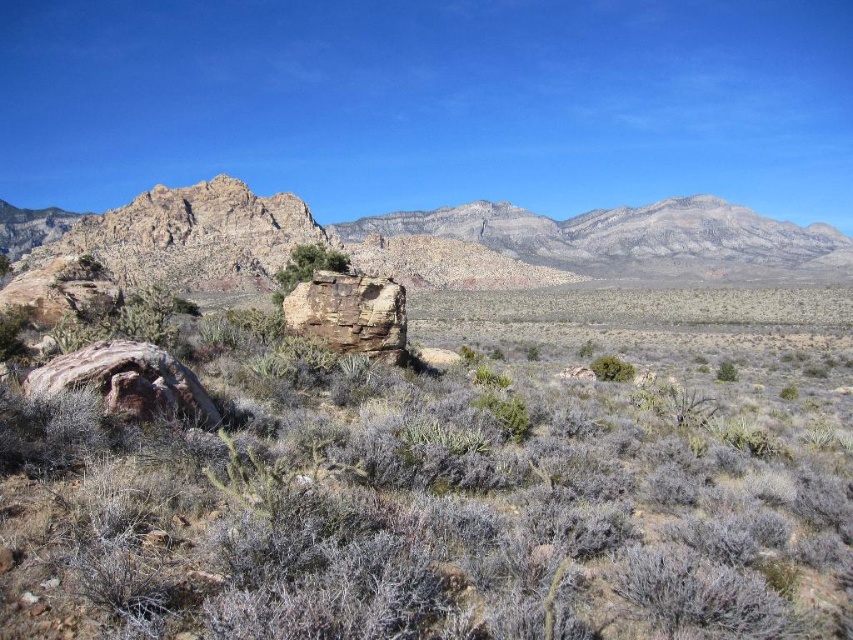
Question: Does rusty rock at center appear under rugged rock formation at upper center?

Choices:
 (A) yes
 (B) no

Answer: (A)

Question: Can you confirm if rusty rock at center is smaller than green leafy bush at center?

Choices:
 (A) no
 (B) yes

Answer: (A)

Question: Which of the following is the closest to the observer?

Choices:
 (A) rusty rock at center
 (B) green leafy shrub at center

Answer: (A)

Question: Does rusty rock at center lie in front of green leafy shrub at center?

Choices:
 (A) yes
 (B) no

Answer: (A)

Question: Which object is the farthest from the green leafy bush at center?

Choices:
 (A) green leafy shrub at center
 (B) rusty rock formation at center
 (C) rugged rock formation at upper center

Answer: (C)

Question: Among these points, which one is nearest to the camera?

Choices:
 (A) (381, 563)
 (B) (315, 248)

Answer: (A)